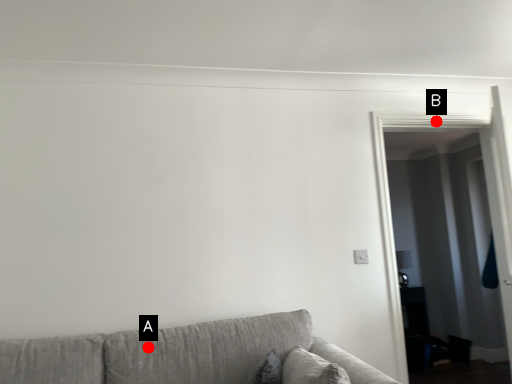
Question: Two points are circled on the image, labeled by A and B beside each circle. Among these points, which one is nearest to the camera?

Choices:
 (A) A is closer
 (B) B is closer

Answer: (A)